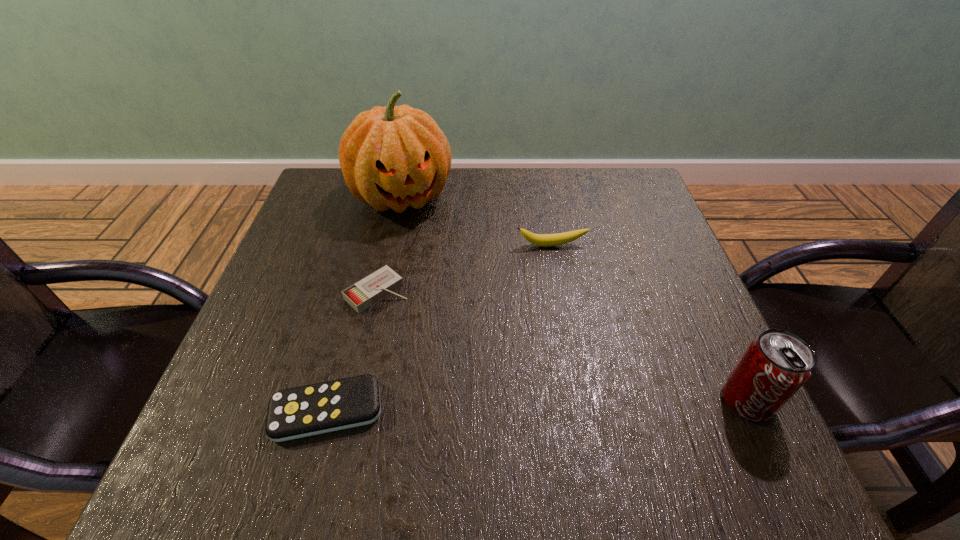
This screenshot has width=960, height=540. Identify the location of vacant space at the left edge of the desktop. (271, 351).

Find the location of a particular element. The image size is (960, 540). blank space at the right edge is located at coordinates (682, 313).

Find the location of a particular element. The image size is (960, 540). vacant space at the far right corner of the desktop is located at coordinates (622, 208).

At what (x,y) coordinates should I click in order to perform the action: click on free space that is in between the tallest object and the matchbox. Please return your answer as a coordinate pair (x, y). Looking at the image, I should click on (390, 245).

Find the location of `vacant point located between the shortest object and the fourth nearest object`. vacant point located between the shortest object and the fourth nearest object is located at coordinates (440, 328).

Where is `empty space between the shortest object and the second farthest object`? empty space between the shortest object and the second farthest object is located at coordinates (440, 328).

Find the location of a particular element. free area in between the matchbox and the tallest object is located at coordinates (390, 245).

Where is `free area in between the remote control and the second tallest object`? free area in between the remote control and the second tallest object is located at coordinates (537, 406).

Identify the location of unoccupied area between the second tallest object and the pumpkin. The width and height of the screenshot is (960, 540). (574, 299).

This screenshot has height=540, width=960. Identify the location of vacant space that's between the shortest object and the fourth nearest object. (440, 328).